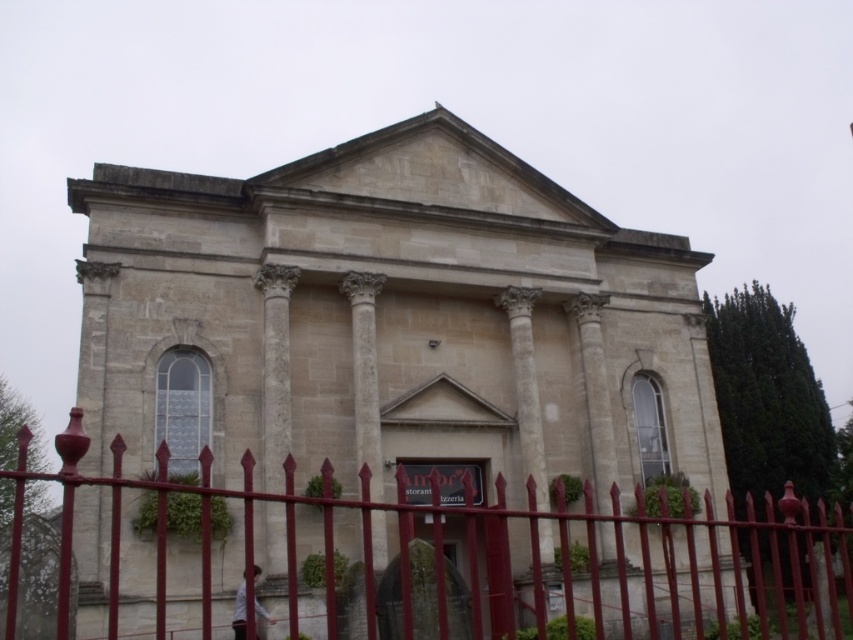
Question: Considering the relative positions of smooth metal fence at center and white stone column at center in the image provided, where is smooth metal fence at center located with respect to white stone column at center?

Choices:
 (A) below
 (B) above

Answer: (A)

Question: Which object is the closest to the beige stone church at center?

Choices:
 (A) white stone column at center
 (B) smooth metal fence at center

Answer: (B)

Question: Which of the following is the closest to the observer?

Choices:
 (A) white stone column at center
 (B) beige stone church at center
 (C) smooth metal fence at center

Answer: (C)

Question: Can you confirm if beige stone church at center is bigger than white stone column at center?

Choices:
 (A) yes
 (B) no

Answer: (A)

Question: Is beige stone church at center positioned before smooth metal fence at center?

Choices:
 (A) yes
 (B) no

Answer: (B)

Question: Which object is positioned closest to the white stone column at center?

Choices:
 (A) beige stone church at center
 (B) smooth metal fence at center

Answer: (A)